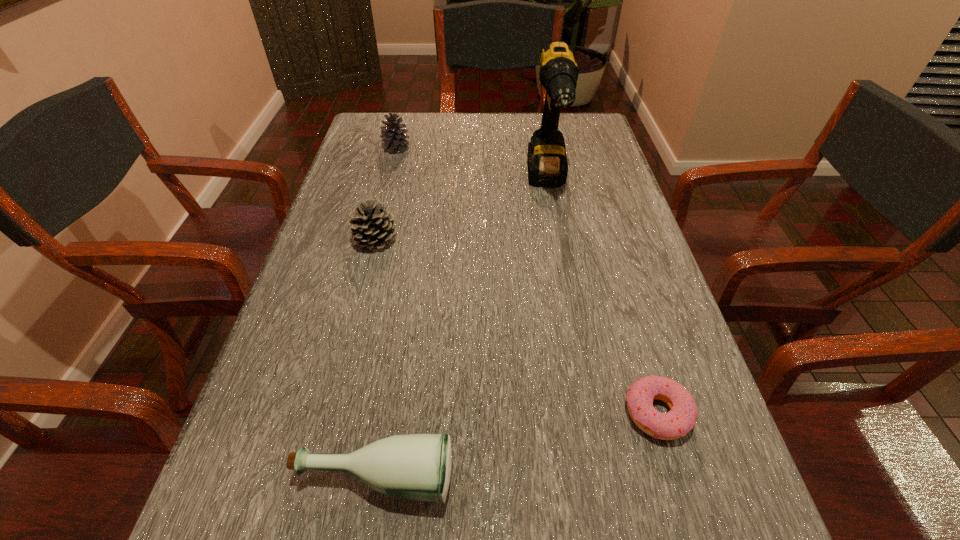
Locate an element on the screen. This screenshot has width=960, height=540. free spot located 0.120m on the back of the farther pinecone is located at coordinates (403, 122).

This screenshot has height=540, width=960. Find the location of `free point located on the back of the fourth tallest object`. free point located on the back of the fourth tallest object is located at coordinates (400, 316).

Locate an element on the screen. free space located on the left of the doughnut is located at coordinates (593, 413).

This screenshot has width=960, height=540. I want to click on object present at the far edge, so click(394, 140).

The width and height of the screenshot is (960, 540). In order to click on bottle situated at the left edge in this screenshot , I will do `click(418, 466)`.

Where is `drill that is at the right edge`? drill that is at the right edge is located at coordinates (547, 163).

Image resolution: width=960 pixels, height=540 pixels. Identify the location of doughnut situated at the right edge. (681, 418).

Find the location of a particular element. Image resolution: width=960 pixels, height=540 pixels. object at the far left corner is located at coordinates (394, 140).

At what (x,y) coordinates should I click in order to perform the action: click on blank space at the far edge of the desktop. Please return your answer as a coordinate pair (x, y). The height and width of the screenshot is (540, 960). Looking at the image, I should click on (427, 126).

Identify the location of free region at the left edge of the desktop. Image resolution: width=960 pixels, height=540 pixels. click(x=341, y=255).